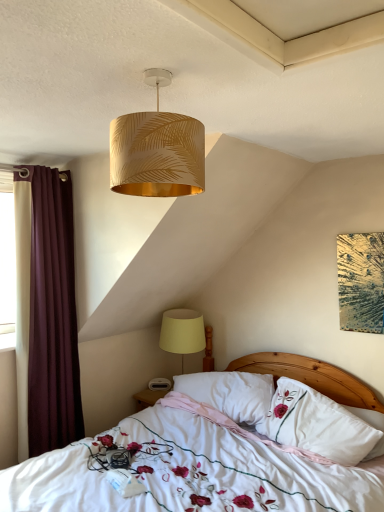
Question: Can you confirm if gold leaf-patterned lampshade at upper center, positioned as the second lamp in bottom-to-top order, is smaller than white soft pillow at center, placed as the 2th pillow when sorted from left to right?

Choices:
 (A) yes
 (B) no

Answer: (A)

Question: Can white soft pillow at center, acting as the first pillow starting from the right, be found inside gold leaf-patterned lampshade at upper center, which is the first lamp in front-to-back order?

Choices:
 (A) no
 (B) yes

Answer: (A)

Question: Is gold leaf-patterned lampshade at upper center, the first lamp positioned from the top, to the right of white soft pillow at center, acting as the first pillow starting from the right, from the viewer's perspective?

Choices:
 (A) no
 (B) yes

Answer: (A)

Question: From a real-world perspective, is gold leaf-patterned lampshade at upper center, the first lamp positioned from the top, under white soft pillow at center, placed as the 2th pillow when sorted from left to right?

Choices:
 (A) yes
 (B) no

Answer: (B)

Question: Considering the relative sizes of gold leaf-patterned lampshade at upper center, the first lamp positioned from the top, and white soft pillow at center, placed as the 2th pillow when sorted from left to right, in the image provided, is gold leaf-patterned lampshade at upper center, the first lamp positioned from the top, shorter than white soft pillow at center, placed as the 2th pillow when sorted from left to right,?

Choices:
 (A) no
 (B) yes

Answer: (B)

Question: Is gold leaf-patterned lampshade at upper center, positioned as the second lamp in bottom-to-top order, aimed at white soft pillow at center, placed as the 2th pillow when sorted from left to right?

Choices:
 (A) yes
 (B) no

Answer: (B)

Question: Does gold leaf-patterned lampshade at upper center, which is the first lamp in front-to-back order, have a smaller size compared to maroon fabric curtain at left?

Choices:
 (A) yes
 (B) no

Answer: (A)

Question: From a real-world perspective, is gold leaf-patterned lampshade at upper center, which is the first lamp in front-to-back order, under maroon fabric curtain at left?

Choices:
 (A) no
 (B) yes

Answer: (A)

Question: Would you say maroon fabric curtain at left is part of gold leaf-patterned lampshade at upper center, acting as the second lamp starting from the back,'s contents?

Choices:
 (A) yes
 (B) no

Answer: (B)

Question: Is gold leaf-patterned lampshade at upper center, positioned as the second lamp in bottom-to-top order, at the left side of maroon fabric curtain at left?

Choices:
 (A) yes
 (B) no

Answer: (B)

Question: Does gold leaf-patterned lampshade at upper center, the first lamp positioned from the top, have a greater height compared to maroon fabric curtain at left?

Choices:
 (A) no
 (B) yes

Answer: (A)

Question: Could you tell me if gold leaf-patterned lampshade at upper center, which is the first lamp in front-to-back order, is facing maroon fabric curtain at left?

Choices:
 (A) no
 (B) yes

Answer: (A)

Question: Is white floral fabric bed at center not near yellow fabric lampshade at lower center, arranged as the second lamp when viewed from the front?

Choices:
 (A) no
 (B) yes

Answer: (A)